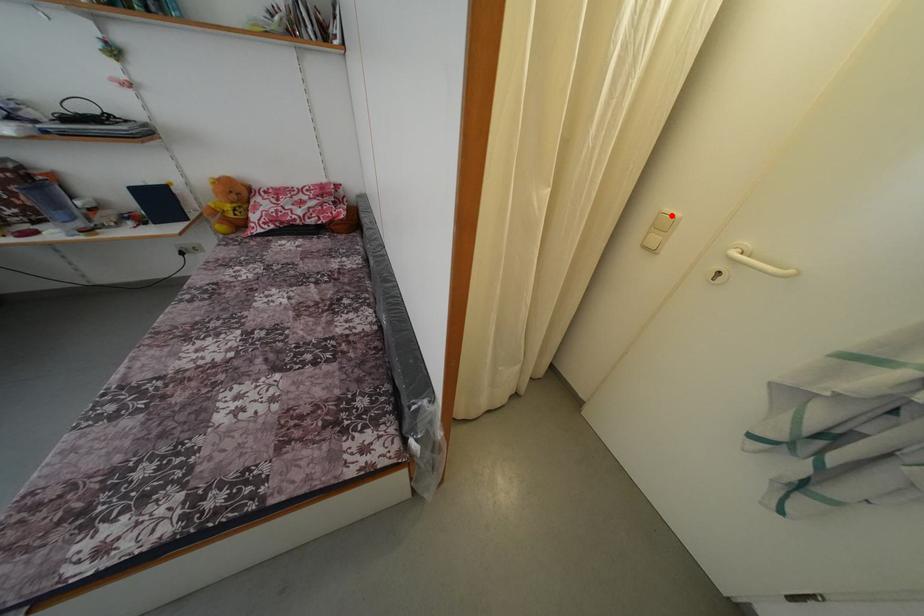
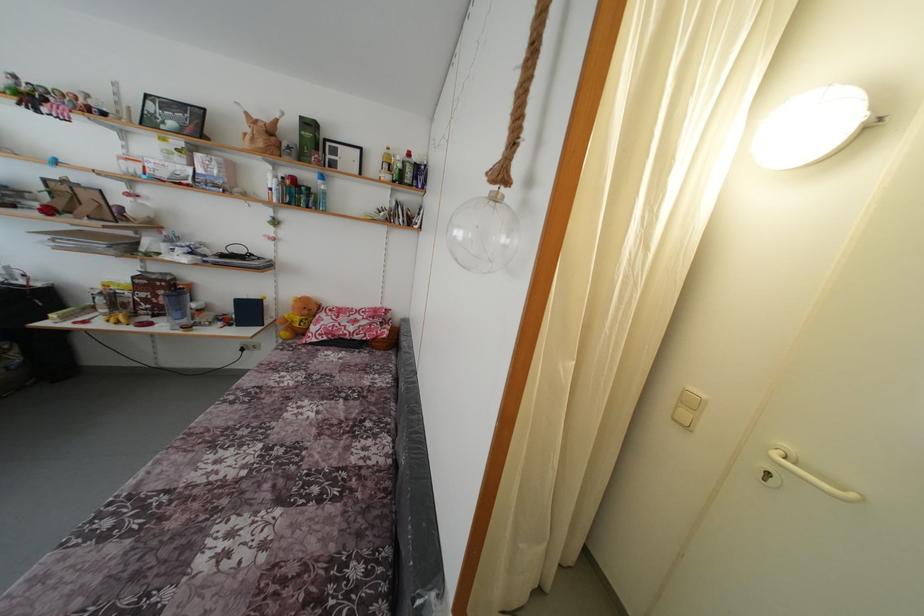
The point at the highlighted location is marked in the first image. Where is the corresponding point in the second image?

(696, 394)